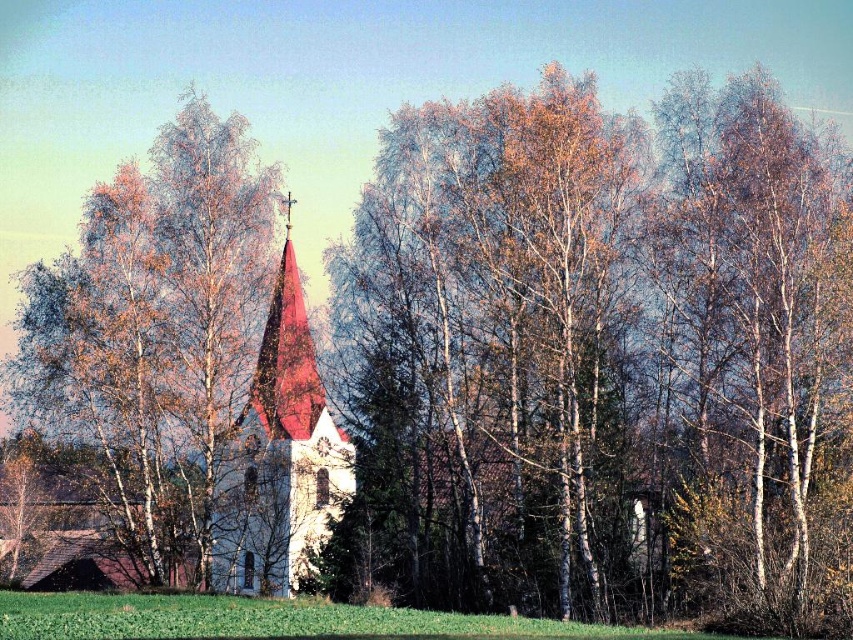
You are standing in the rural area and see the smooth white bark at center and the green grassy field at lower center. Which object is located higher up in the image?

The smooth white bark at center is positioned over the green grassy field at lower center, so it is higher up in the image.